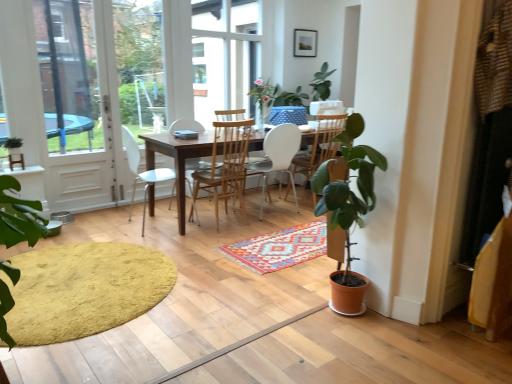
This screenshot has width=512, height=384. Identify the location of free space in front of wooden chair at center, arranged as the 2th chair when viewed from the left. coord(209,235).